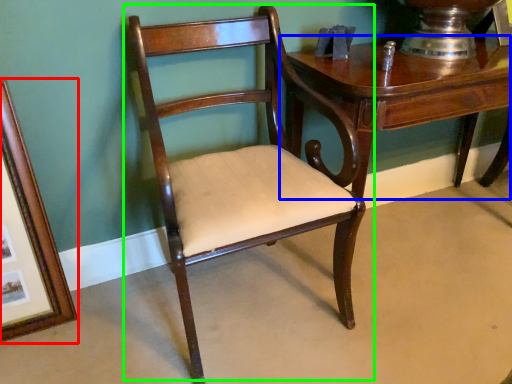
Question: Based on their relative distances, which object is nearer to picture frame (highlighted by a red box)? Choose from table (highlighted by a blue box) and chair (highlighted by a green box).

Choices:
 (A) table
 (B) chair

Answer: (B)